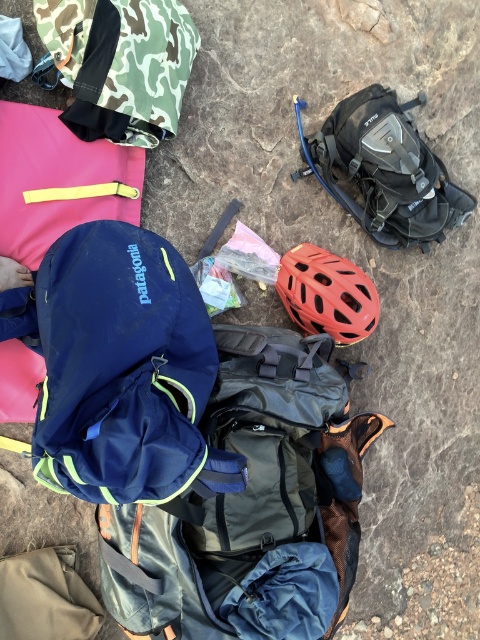
Does point (381, 113) come closer to viewer compared to point (361, 317)?

No, it is behind (361, 317).

You are a GUI agent. You are given a task and a screenshot of the screen. Output one action in this format:
    pyautogui.click(x=<x>, y=<y>)
    Task: Click on the black matte hydration backpack at upper right
    The height and width of the screenshot is (640, 480).
    Given the screenshot: What is the action you would take?
    pyautogui.click(x=384, y=170)

You are a GUI agent. You are given a task and a screenshot of the screen. Output one action in this format:
    pyautogui.click(x=<x>, y=<y>)
    Task: Click on the black matte hydration backpack at upper right
    The width and height of the screenshot is (480, 640).
    Given the screenshot: What is the action you would take?
    pyautogui.click(x=384, y=170)

Can you confirm if camo fabric backpack at upper left is smaller than matte red helmet at center?

No, camo fabric backpack at upper left is not smaller than matte red helmet at center.

Based on the photo, measure the distance between camo fabric backpack at upper left and camera.

They are 5.41 feet apart.

Locate an element on the screen. The image size is (480, 640). camo fabric backpack at upper left is located at coordinates (120, 65).

Between point (271, 472) and point (108, 28), which one is positioned in front?

Point (271, 472)

Is point (214, 326) positioned before point (118, 100)?

No, it is behind (118, 100).

Find the location of a particular element. The height and width of the screenshot is (640, 480). navy blue fabric backpack at center is located at coordinates (252, 506).